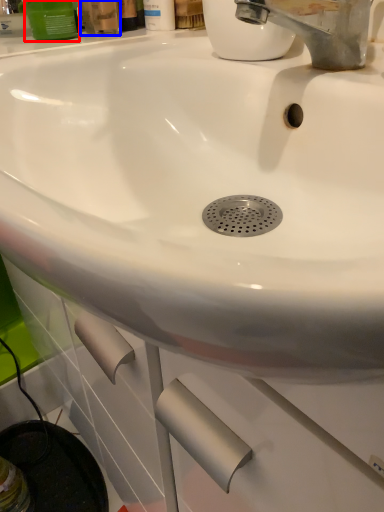
Question: Which object appears farthest to the camera in this image, mouthwash (highlighted by a red box) or mouthwash (highlighted by a blue box)?

Choices:
 (A) mouthwash
 (B) mouthwash

Answer: (A)